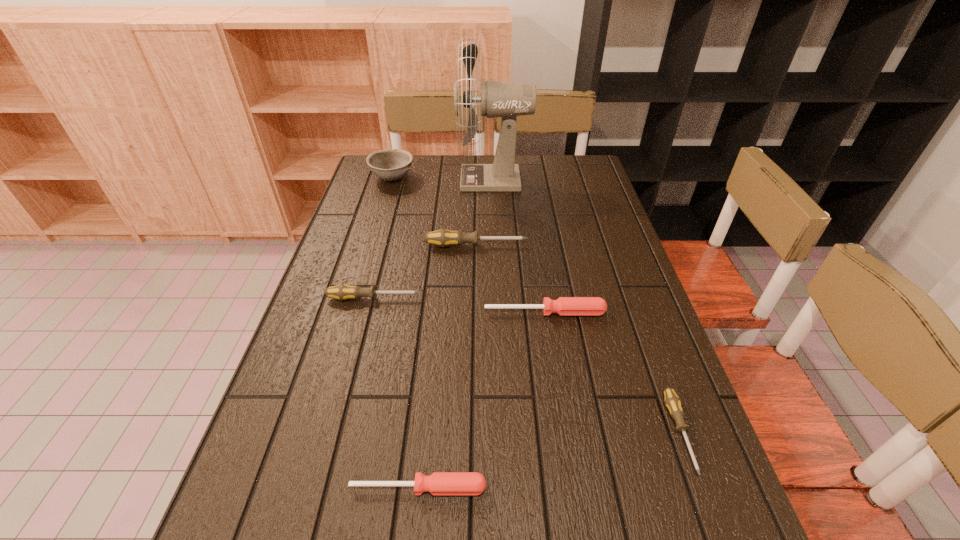
In the image, there is a desktop. In order to click on free space at the right edge in this screenshot , I will do `click(582, 245)`.

Image resolution: width=960 pixels, height=540 pixels. Find the location of `vacant space at the far left corner of the desktop`. vacant space at the far left corner of the desktop is located at coordinates (402, 184).

You are a GUI agent. You are given a task and a screenshot of the screen. Output one action in this format:
    pyautogui.click(x=<x>, y=<y>)
    Task: Click on the unoccupied area between the bowl and the gray fan
    
    Given the screenshot: What is the action you would take?
    pyautogui.click(x=443, y=179)

Identify the location of free space between the gray bowl and the tallest screwdriver. (434, 212).

I want to click on vacant space that's between the fourth nearest object and the tallest screwdriver, so click(x=425, y=272).

You are a GUI agent. You are given a task and a screenshot of the screen. Output one action in this format:
    pyautogui.click(x=<x>, y=<y>)
    Task: Click on the vacant space in between the second biggest gray screwdriver and the smaller red screwdriver
    The width and height of the screenshot is (960, 540).
    Given the screenshot: What is the action you would take?
    pyautogui.click(x=396, y=393)

Image resolution: width=960 pixels, height=540 pixels. Find the location of `free space between the smallest gray screwdriver and the tallest screwdriver`. free space between the smallest gray screwdriver and the tallest screwdriver is located at coordinates (578, 339).

The width and height of the screenshot is (960, 540). I want to click on empty location between the fifth farthest object and the rightmost screwdriver, so click(612, 373).

You are a GUI agent. You are given a task and a screenshot of the screen. Output one action in this format:
    pyautogui.click(x=<x>, y=<y>)
    Task: Click on the free space between the second farthest gray screwdriver and the biggest gray screwdriver
    
    Given the screenshot: What is the action you would take?
    pyautogui.click(x=425, y=272)

Point out which object is positioned as the sixth nearest to the rightmost screwdriver. Please provide its 2D coordinates. Your answer should be formatted as a tuple, i.e. [(x, y)], where the tuple contains the x and y coordinates of a point satisfying the conditions above.

[(390, 164)]